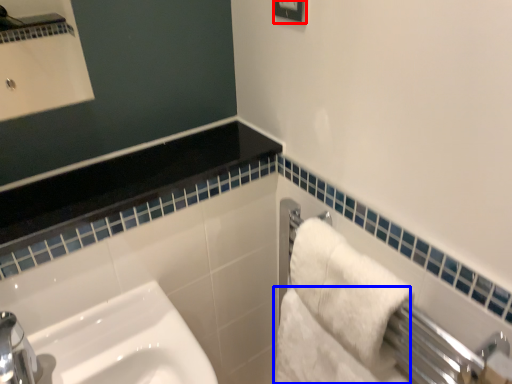
Question: Which point is further to the camera, square (highlighted by a red box) or bath towel (highlighted by a blue box)?

Choices:
 (A) square
 (B) bath towel

Answer: (B)